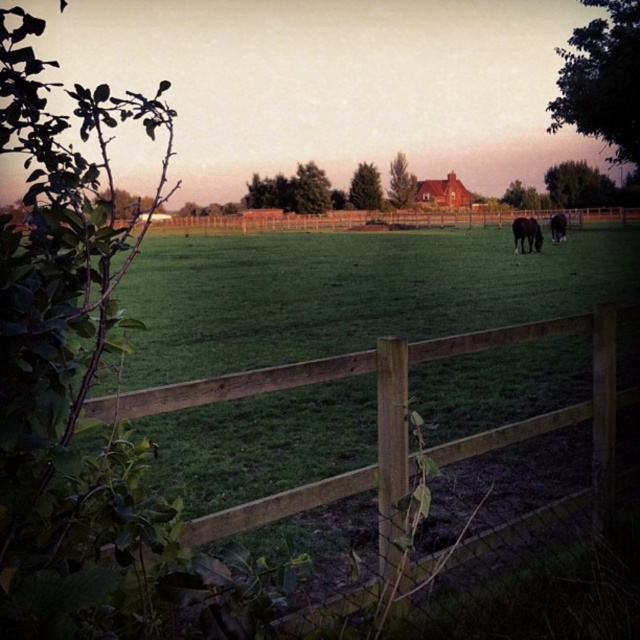
Consider the image. You are standing at the center of the image and want to walk towards the wooden fence at lower center. In which direction should you move?

Since the wooden fence at lower center is located at point (392,420) in 2D coordinates, you should move downward and to the right from the center to reach it.